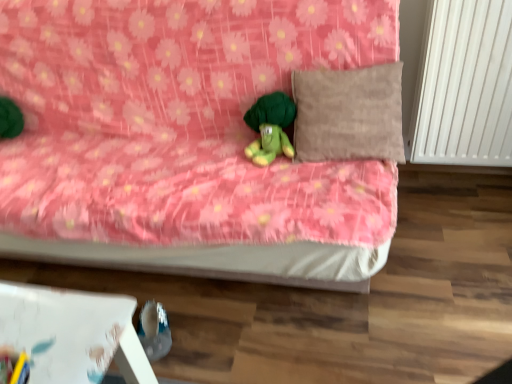
Question: Considering the relative sizes of white smooth radiator at right and green plush turtle at center in the image provided, is white smooth radiator at right thinner than green plush turtle at center?

Choices:
 (A) no
 (B) yes

Answer: (A)

Question: Would you consider white smooth radiator at right to be distant from green plush turtle at center?

Choices:
 (A) yes
 (B) no

Answer: (B)

Question: Is white smooth radiator at right aimed at green plush turtle at center?

Choices:
 (A) yes
 (B) no

Answer: (B)

Question: From a real-world perspective, is white smooth radiator at right on green plush turtle at center?

Choices:
 (A) no
 (B) yes

Answer: (A)

Question: Can you confirm if white smooth radiator at right is bigger than green plush turtle at center?

Choices:
 (A) yes
 (B) no

Answer: (A)

Question: Does point (286, 145) appear closer or farther from the camera than point (210, 196)?

Choices:
 (A) closer
 (B) farther

Answer: (B)

Question: Based on their sizes in the image, would you say green plush turtle at center is bigger or smaller than pink floral fabric bed at center?

Choices:
 (A) big
 (B) small

Answer: (B)

Question: In the image, is green plush turtle at center on the left side or the right side of pink floral fabric bed at center?

Choices:
 (A) left
 (B) right

Answer: (B)

Question: Is green plush turtle at center taller or shorter than pink floral fabric bed at center?

Choices:
 (A) short
 (B) tall

Answer: (A)

Question: From a real-world perspective, is pink floral fabric bed at center physically located above or below suede-like beige pillow at upper right?

Choices:
 (A) below
 (B) above

Answer: (A)

Question: Is pink floral fabric bed at center wider or thinner than suede-like beige pillow at upper right?

Choices:
 (A) thin
 (B) wide

Answer: (B)

Question: In terms of height, does pink floral fabric bed at center look taller or shorter compared to suede-like beige pillow at upper right?

Choices:
 (A) tall
 (B) short

Answer: (A)

Question: Would you say pink floral fabric bed at center is to the left or to the right of suede-like beige pillow at upper right in the picture?

Choices:
 (A) left
 (B) right

Answer: (A)

Question: From the image's perspective, is green plush turtle at center above or below suede-like beige pillow at upper right?

Choices:
 (A) below
 (B) above

Answer: (A)

Question: In terms of height, does green plush turtle at center look taller or shorter compared to suede-like beige pillow at upper right?

Choices:
 (A) tall
 (B) short

Answer: (B)